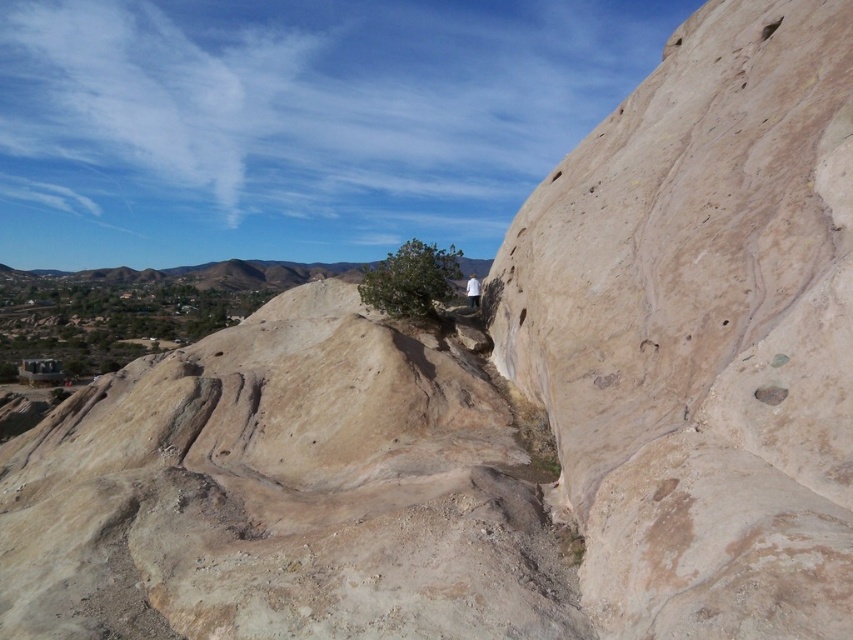
Can you confirm if beige rock cliff at center right is positioned above smooth beige rock at center?

Correct, beige rock cliff at center right is located above smooth beige rock at center.

Is beige rock cliff at center right bigger than smooth beige rock at center?

No.

The width and height of the screenshot is (853, 640). In order to click on beige rock cliff at center right in this screenshot , I will do `click(701, 332)`.